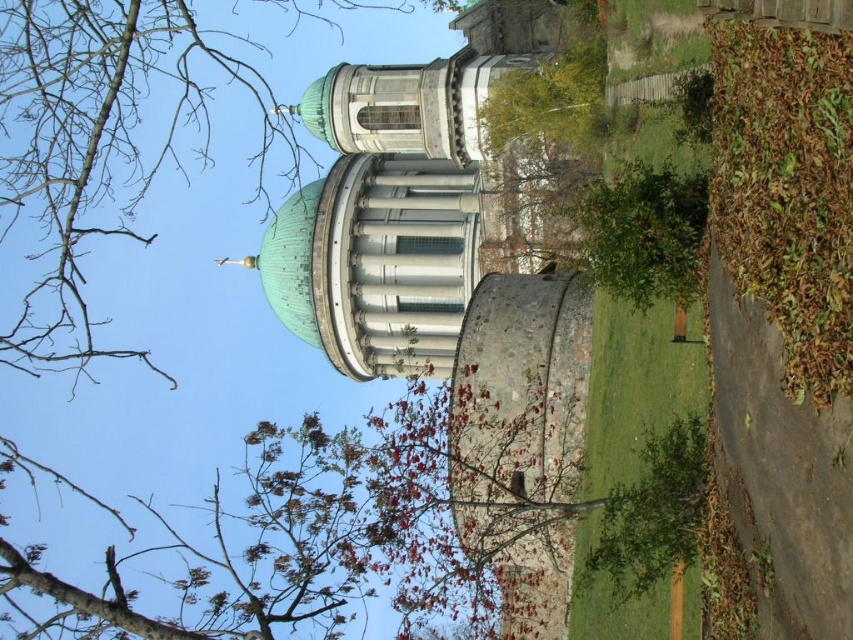
Question: Does green dome at center appear on the left side of brown leafy tree at upper center?

Choices:
 (A) no
 (B) yes

Answer: (A)

Question: Is green dome at center behind brown leafy tree at upper center?

Choices:
 (A) no
 (B) yes

Answer: (B)

Question: Which of the following is the closest to the observer?

Choices:
 (A) (329, 353)
 (B) (85, 12)

Answer: (B)

Question: Can you confirm if green dome at center is wider than brown leafy tree at upper center?

Choices:
 (A) yes
 (B) no

Answer: (B)

Question: Which of the following is the farthest from the observer?

Choices:
 (A) brown leafy tree at upper center
 (B) green dome at center

Answer: (B)

Question: Which point appears closest to the camera in this image?

Choices:
 (A) (53, 317)
 (B) (287, 280)

Answer: (B)